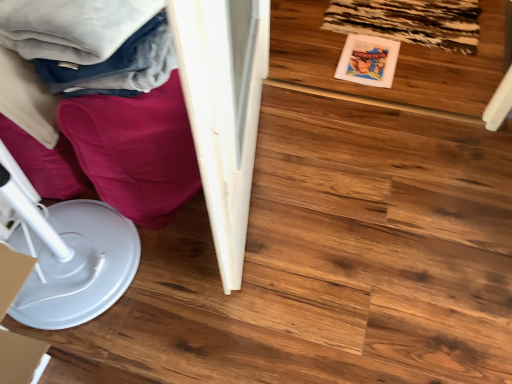
What do you see at coordinates (77, 265) in the screenshot? Image resolution: width=512 pixels, height=384 pixels. I see `white plastic paper plate at lower left` at bounding box center [77, 265].

What is the approximate width of wooden floor at center?

It is 35.58 inches.

Where is `soft cotton blanket at upper left`? This screenshot has width=512, height=384. soft cotton blanket at upper left is located at coordinates (72, 27).

Identify the location of white plastic paper plate at lower left. The width and height of the screenshot is (512, 384). (77, 265).

Which of these two, white glossy wardrobe at left or soft cotton blanket at upper left, is thinner?

white glossy wardrobe at left is thinner.

Between white glossy wardrobe at left and soft cotton blanket at upper left, which one appears on the right side from the viewer's perspective?

From the viewer's perspective, white glossy wardrobe at left appears more on the right side.

Does white glossy wardrobe at left lie behind soft cotton blanket at upper left?

Yes, white glossy wardrobe at left is further from the viewer.

From a real-world perspective, is white glossy wardrobe at left positioned above or below soft cotton blanket at upper left?

white glossy wardrobe at left is situated lower than soft cotton blanket at upper left in the real world.

Who is smaller, white glossy wardrobe at left or white plastic paper plate at lower left?

white plastic paper plate at lower left.

Considering the positions of objects white glossy wardrobe at left and white plastic paper plate at lower left in the image provided, who is more to the left, white glossy wardrobe at left or white plastic paper plate at lower left?

white plastic paper plate at lower left.

Considering the sizes of objects white glossy wardrobe at left and white plastic paper plate at lower left in the image provided, who is shorter, white glossy wardrobe at left or white plastic paper plate at lower left?

white plastic paper plate at lower left.

Considering the sizes of objects white plastic paper plate at lower left and wooden floor at center in the image provided, who is smaller, white plastic paper plate at lower left or wooden floor at center?

With smaller size is white plastic paper plate at lower left.

In the scene shown: Can you tell me how much white plastic paper plate at lower left and wooden floor at center differ in facing direction?

The angle between the facing direction of white plastic paper plate at lower left and the facing direction of wooden floor at center is 88.5 degrees.

Between white plastic paper plate at lower left and wooden floor at center, which one appears on the right side from the viewer's perspective?

Positioned to the right is wooden floor at center.

Which is in front, point (96, 290) or point (479, 21)?

Point (96, 290)

Could white plastic paper plate at lower left be considered to be inside soft cotton blanket at upper left?

Definitely not — white plastic paper plate at lower left is not inside soft cotton blanket at upper left.

From the image's perspective, is soft cotton blanket at upper left located beneath white plastic paper plate at lower left?

Incorrect, from the image's perspective, soft cotton blanket at upper left is higher than white plastic paper plate at lower left.

From the picture: Who is shorter, soft cotton blanket at upper left or white plastic paper plate at lower left?

soft cotton blanket at upper left is shorter.

Considering the sizes of objects soft cotton blanket at upper left and white plastic paper plate at lower left in the image provided, who is thinner, soft cotton blanket at upper left or white plastic paper plate at lower left?

white plastic paper plate at lower left.

Is soft cotton blanket at upper left outside of wooden floor at center?

soft cotton blanket at upper left is positioned outside wooden floor at center.

Can you confirm if soft cotton blanket at upper left is smaller than wooden floor at center?

Indeed, soft cotton blanket at upper left has a smaller size compared to wooden floor at center.

Which object is thinner, soft cotton blanket at upper left or wooden floor at center?

Thinner between the two is soft cotton blanket at upper left.

From a real-world perspective, between soft cotton blanket at upper left and wooden floor at center, who is vertically higher?

In real-world perspective, soft cotton blanket at upper left is above.

From the picture: How distant is wooden floor at center from white glossy wardrobe at left?

wooden floor at center and white glossy wardrobe at left are 22.43 inches apart from each other.

Identify the location of furniture lying below the wooden floor at center (from the image's perspective). The height and width of the screenshot is (384, 512). (224, 109).

Considering the relative positions of wooden floor at center and white glossy wardrobe at left in the image provided, is wooden floor at center to the right of white glossy wardrobe at left from the viewer's perspective?

Yes, wooden floor at center is to the right of white glossy wardrobe at left.

From a real-world perspective, which object stands above the other?

From a 3D spatial view, white glossy wardrobe at left is above.

Which object is positioned more to the right, white glossy wardrobe at left or wooden floor at center?

wooden floor at center.

Consider the image. Is white glossy wardrobe at left inside or outside of wooden floor at center?

white glossy wardrobe at left is not inside wooden floor at center, it's outside.

How many degrees apart are the facing directions of white glossy wardrobe at left and wooden floor at center?

The facing directions of white glossy wardrobe at left and wooden floor at center are 88.6 degrees apart.

Between white glossy wardrobe at left and wooden floor at center, which one has smaller size?

wooden floor at center.

Locate an element on the screen. This screenshot has width=512, height=384. furniture lying below the soft cotton blanket at upper left (from the image's perspective) is located at coordinates coord(224,109).

Where is `paper plate located in front of the white glossy wardrobe at left`? paper plate located in front of the white glossy wardrobe at left is located at coordinates (77, 265).

Looking at the image, which one is located further to wooden floor at center, white glossy wardrobe at left or soft cotton blanket at upper left?

soft cotton blanket at upper left is positioned further to the anchor wooden floor at center.

Estimate the real-world distances between objects in this image. Which object is closer to wooden floor at center, soft cotton blanket at upper left or white glossy wardrobe at left?

white glossy wardrobe at left is positioned closer to the anchor wooden floor at center.

When comparing their distances from white plastic paper plate at lower left, does wooden floor at center or white glossy wardrobe at left seem closer?

The object closer to white plastic paper plate at lower left is white glossy wardrobe at left.

When comparing their distances from soft cotton blanket at upper left, does white glossy wardrobe at left or wooden floor at center seem further?

The object further to soft cotton blanket at upper left is wooden floor at center.

Which object lies further to the anchor point white glossy wardrobe at left, soft cotton blanket at upper left or wooden floor at center?

wooden floor at center lies further to white glossy wardrobe at left than the other object.

Which object lies nearer to the anchor point white plastic paper plate at lower left, white glossy wardrobe at left or wooden floor at center?

white glossy wardrobe at left is closer to white plastic paper plate at lower left.

Estimate the real-world distances between objects in this image. Which object is closer to white glossy wardrobe at left, white plastic paper plate at lower left or wooden floor at center?

white plastic paper plate at lower left.

Which object lies further to the anchor point white plastic paper plate at lower left, wooden floor at center or soft cotton blanket at upper left?

Among the two, wooden floor at center is located further to white plastic paper plate at lower left.

Identify the location of furniture between white plastic paper plate at lower left and wooden floor at center. Image resolution: width=512 pixels, height=384 pixels. (224, 109).

Identify the location of furniture between soft cotton blanket at upper left and wooden floor at center. The image size is (512, 384). (224, 109).

What are the coordinates of `furniture between soft cotton blanket at upper left and white plastic paper plate at lower left vertically` in the screenshot? It's located at (224, 109).

The image size is (512, 384). What are the coordinates of `clothing located between white plastic paper plate at lower left and wooden floor at center in the left-right direction` in the screenshot? It's located at (72, 27).